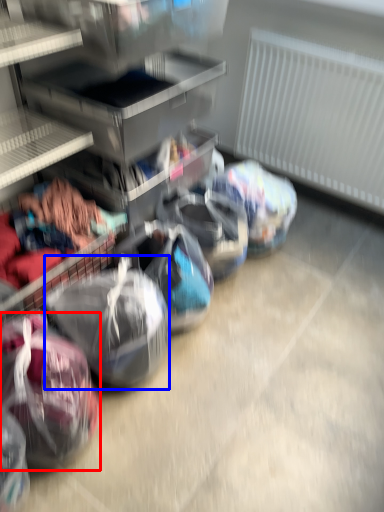
Question: Which object is closer to the camera taking this photo, sack (highlighted by a red box) or sack (highlighted by a blue box)?

Choices:
 (A) sack
 (B) sack

Answer: (A)